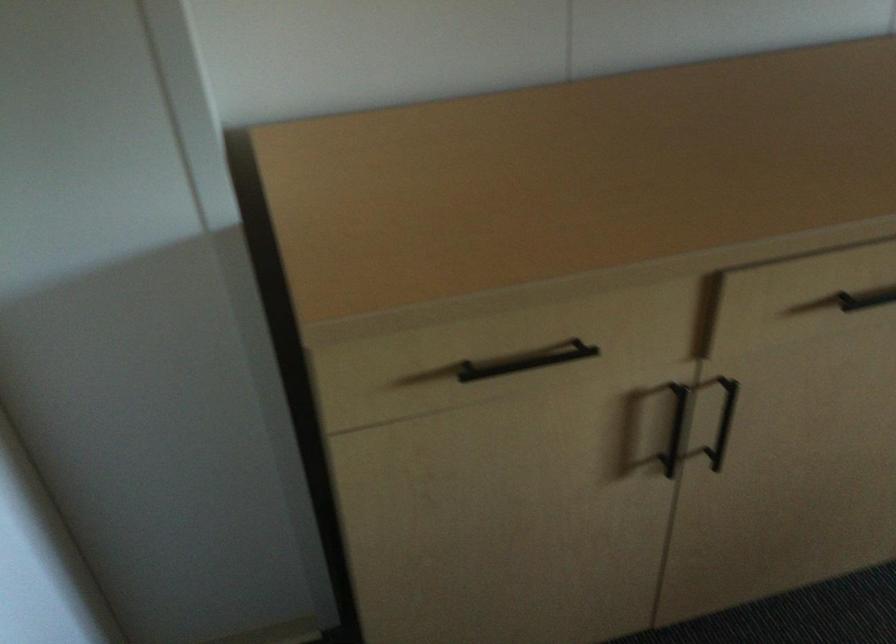
Where is `black drawer handle`? The image size is (896, 644). black drawer handle is located at coordinates (526, 361).